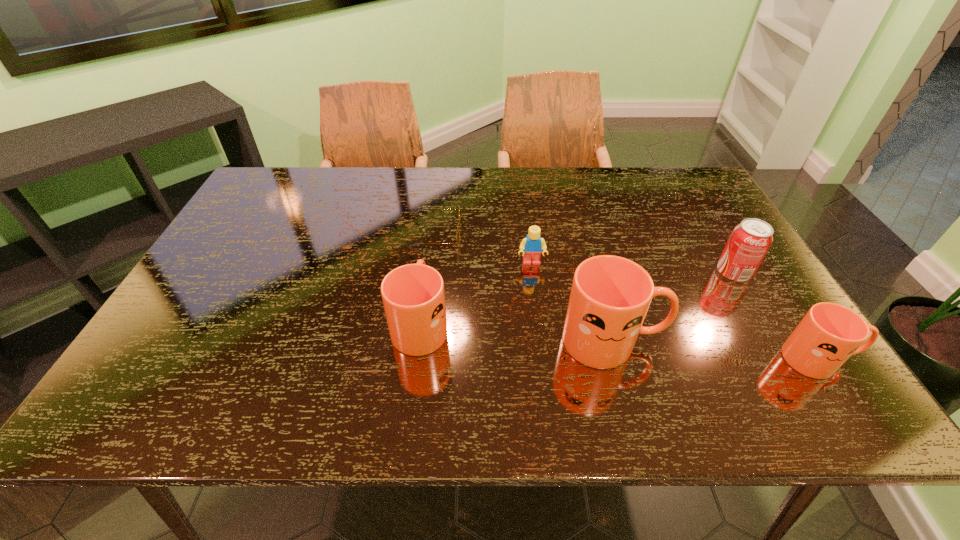
Find the location of `vacant position located on the handle side of the second tallest mug`. vacant position located on the handle side of the second tallest mug is located at coordinates (427, 270).

The width and height of the screenshot is (960, 540). I want to click on vacant space situated on the handle side of the fourth object from left to right, so click(x=791, y=341).

The width and height of the screenshot is (960, 540). What are the coordinates of `free space located 0.070m on the lenses of the farthest object` in the screenshot? It's located at (486, 235).

Image resolution: width=960 pixels, height=540 pixels. Find the location of `free space located on the front-facing side of the fourth object from right to left`. free space located on the front-facing side of the fourth object from right to left is located at coordinates (542, 351).

Find the location of a particular element. The height and width of the screenshot is (540, 960). blank space located 0.120m on the front of the soda is located at coordinates (762, 321).

What are the coordinates of `mug that is at the right edge` in the screenshot? It's located at (826, 337).

This screenshot has width=960, height=540. What are the coordinates of `soda present at the right edge` in the screenshot? It's located at (750, 240).

At what (x,y) coordinates should I click in order to perform the action: click on object that is at the near right corner. Please return your answer as a coordinate pair (x, y). This screenshot has height=540, width=960. Looking at the image, I should click on (826, 337).

The width and height of the screenshot is (960, 540). In the image, there is a desktop. In order to click on free region at the far edge in this screenshot , I will do `click(342, 167)`.

You are a GUI agent. You are given a task and a screenshot of the screen. Output one action in this format:
    pyautogui.click(x=<x>, y=<y>)
    Task: Click on the free space at the near edge of the desktop
    This screenshot has width=960, height=540.
    Given the screenshot: What is the action you would take?
    pyautogui.click(x=246, y=364)